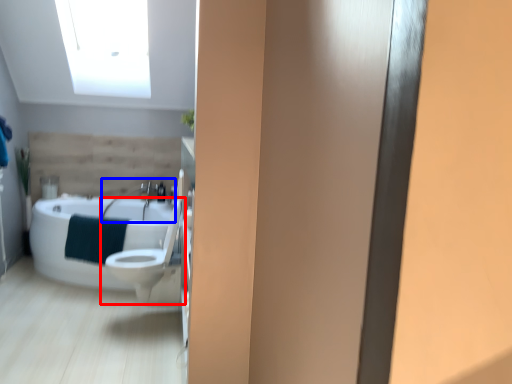
Question: Which object appears farthest to the camera in this image, toilet (highlighted by a red box) or sink (highlighted by a blue box)?

Choices:
 (A) toilet
 (B) sink

Answer: (B)